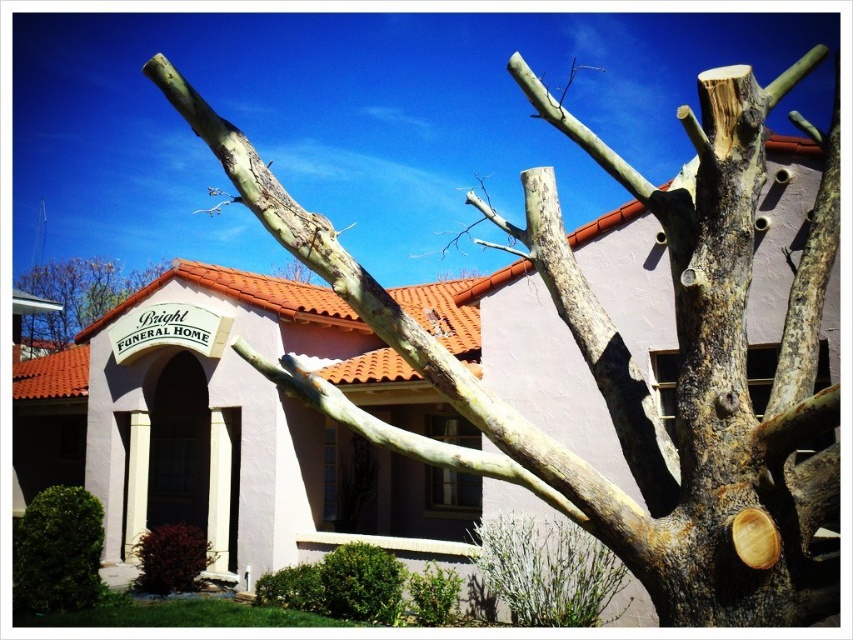
Question: Can you confirm if brown rough bark tree at upper right is thinner than smooth bark tree at center?

Choices:
 (A) yes
 (B) no

Answer: (A)

Question: Observing the image, what is the correct spatial positioning of brown rough bark tree at upper right in reference to smooth bark tree at center?

Choices:
 (A) right
 (B) left

Answer: (A)

Question: Among these points, which one is nearest to the camera?

Choices:
 (A) (815, 604)
 (B) (73, 268)

Answer: (A)

Question: Which object appears closest to the camera in this image?

Choices:
 (A) smooth bark tree at center
 (B) brown rough bark tree at upper right

Answer: (B)

Question: Does brown rough bark tree at upper right lie behind smooth bark tree at center?

Choices:
 (A) yes
 (B) no

Answer: (B)